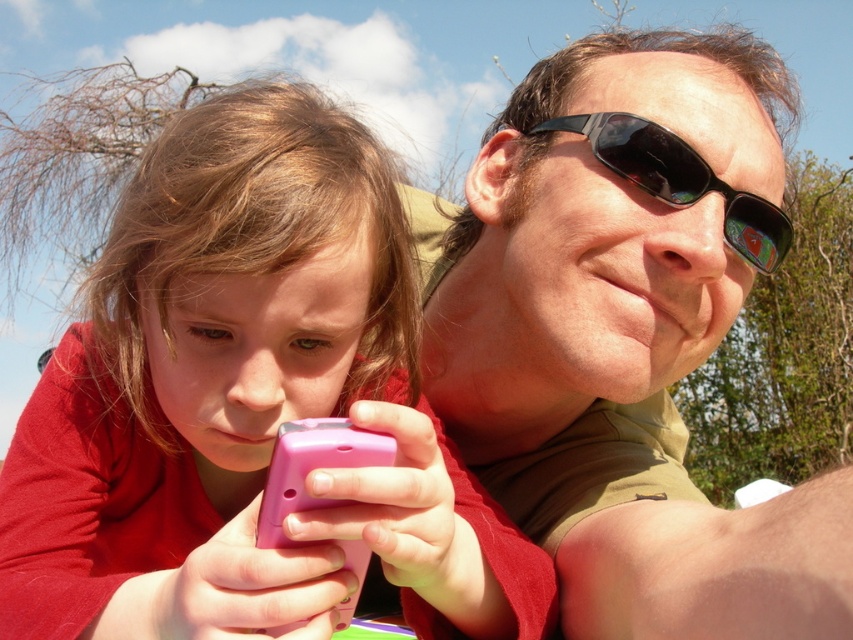
In the scene shown: You are a photographer trying to capture a candid shot of the two people in the image. You notice the pink matte phone at center and the matte black sunglasses at upper center. Which object is shorter in height?

The pink matte phone at center is shorter in height compared to the matte black sunglasses at upper center.

Consider the image. You are a photographer trying to capture a candid shot of the two people in the scene. You notice both the matte black sunglasses at upper center and the black plastic sunglasses at upper center. Which pair of sunglasses is positioned to the left?

The matte black sunglasses at upper center is positioned to the left of the black plastic sunglasses at upper center.

You are standing in front of the image and want to determine which of the two points, point (102, 380) or point (663, 131), is nearer to you. Based on the scene description, which point is closer?

Point (102, 380) is closer to the viewer than point (663, 131).